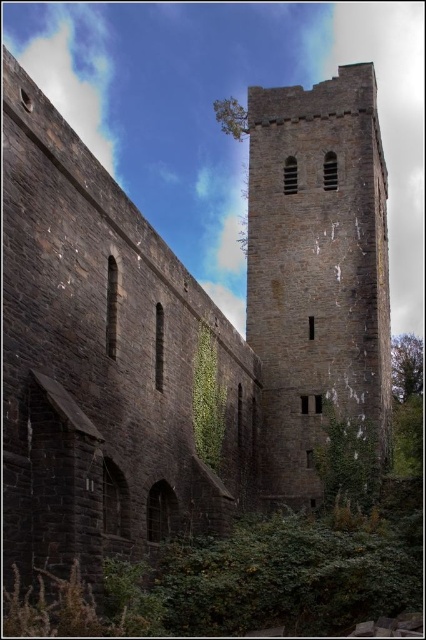
Can you confirm if dark gray stone tower at center is positioned to the left of green rough ivy at lower right?

In fact, dark gray stone tower at center is to the right of green rough ivy at lower right.

Between dark gray stone tower at center and green rough ivy at lower right, which one appears on the right side from the viewer's perspective?

dark gray stone tower at center is more to the right.

Is point (374, 352) less distant than point (339, 480)?

That is False.

Where is `dark gray stone tower at center`? dark gray stone tower at center is located at coordinates (316, 269).

Consider the image. Who is more distant from viewer, (279,452) or (216,381)?

Point (279,452)

Consider the image. Does dark gray stone tower at center appear on the left side of green leafy ivy at center?

In fact, dark gray stone tower at center is to the right of green leafy ivy at center.

Locate an element on the screen. This screenshot has height=640, width=426. dark gray stone tower at center is located at coordinates (316, 269).

Identify the location of dark gray stone tower at center. (316, 269).

Who is higher up, green rough ivy at lower right or green leafy ivy at center?

green leafy ivy at center is higher up.

Who is lower down, green rough ivy at lower right or green leafy ivy at center?

Positioned lower is green rough ivy at lower right.

Is point (348, 472) more distant than point (221, 420)?

Yes, it is behind point (221, 420).

Find the location of a particular element. This screenshot has height=640, width=426. green rough ivy at lower right is located at coordinates (347, 458).